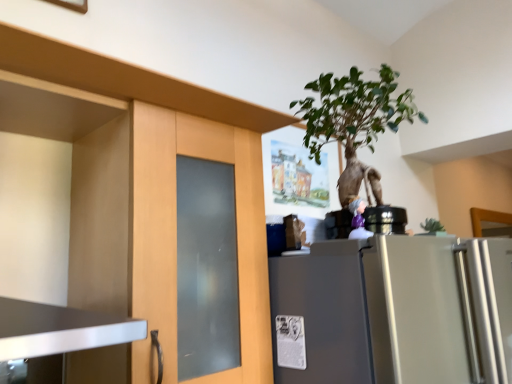
Question: Is green leafy plant at upper center next to matte wood cabinet at left?

Choices:
 (A) yes
 (B) no

Answer: (B)

Question: Is matte wood cabinet at left inside green leafy plant at upper center?

Choices:
 (A) yes
 (B) no

Answer: (B)

Question: Is the position of green leafy plant at upper center less distant than that of matte wood cabinet at left?

Choices:
 (A) yes
 (B) no

Answer: (B)

Question: Is green leafy plant at upper center smaller than matte wood cabinet at left?

Choices:
 (A) yes
 (B) no

Answer: (A)

Question: Is green leafy plant at upper center bigger than matte wood cabinet at left?

Choices:
 (A) yes
 (B) no

Answer: (B)

Question: Is green leafy plant at upper center taller or shorter than satin silver refrigerator at right?

Choices:
 (A) tall
 (B) short

Answer: (B)

Question: Does point (320, 129) appear closer or farther from the camera than point (479, 258)?

Choices:
 (A) farther
 (B) closer

Answer: (A)

Question: From a real-world perspective, is green leafy plant at upper center positioned above or below satin silver refrigerator at right?

Choices:
 (A) below
 (B) above

Answer: (B)

Question: Is green leafy plant at upper center situated inside satin silver refrigerator at right or outside?

Choices:
 (A) inside
 (B) outside

Answer: (B)

Question: From their relative heights in the image, would you say satin silver refrigerator at right is taller or shorter than matte wood cabinet at left?

Choices:
 (A) short
 (B) tall

Answer: (B)

Question: Is point (453, 339) closer or farther from the camera than point (258, 185)?

Choices:
 (A) farther
 (B) closer

Answer: (B)

Question: From the image's perspective, relative to matte wood cabinet at left, is satin silver refrigerator at right above or below?

Choices:
 (A) below
 (B) above

Answer: (A)

Question: Considering the positions of satin silver refrigerator at right and matte wood cabinet at left in the image, is satin silver refrigerator at right bigger or smaller than matte wood cabinet at left?

Choices:
 (A) big
 (B) small

Answer: (A)

Question: Considering their positions, is green leafy plant at upper center located in front of or behind matte wood cabinet at left?

Choices:
 (A) front
 (B) behind

Answer: (B)

Question: Choose the correct answer: Is green leafy plant at upper center inside matte wood cabinet at left or outside it?

Choices:
 (A) outside
 (B) inside

Answer: (A)